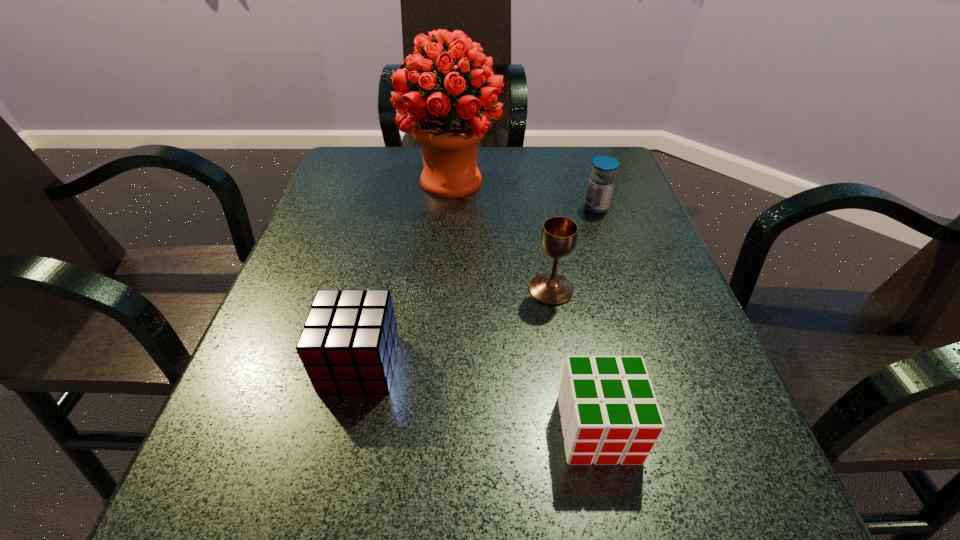
You are a GUI agent. You are given a task and a screenshot of the screen. Output one action in this format:
    pyautogui.click(x=<x>, y=<y>)
    Task: Click on the free space at the right edge of the desktop
    This screenshot has height=540, width=960.
    Given the screenshot: What is the action you would take?
    pyautogui.click(x=708, y=436)

Where is `vacant region at the far left corner of the desktop`? The image size is (960, 540). vacant region at the far left corner of the desktop is located at coordinates (340, 180).

The width and height of the screenshot is (960, 540). What are the coordinates of `vacant space at the near left corner of the desktop` in the screenshot? It's located at (278, 474).

At what (x,y) coordinates should I click in order to perform the action: click on vacant position at the far right corner of the desktop. Please return your answer as a coordinate pair (x, y). Image resolution: width=960 pixels, height=540 pixels. Looking at the image, I should click on (596, 156).

You are a GUI agent. You are given a task and a screenshot of the screen. Output one action in this format:
    pyautogui.click(x=<x>, y=<y>)
    Task: Click on the blank space at the near right corner of the desktop
    
    Given the screenshot: What is the action you would take?
    pyautogui.click(x=695, y=529)

Identify the location of vacant space that is in between the left cube and the third nearest object. The width and height of the screenshot is (960, 540). (455, 327).

Locate an element on the screen. The width and height of the screenshot is (960, 540). unoccupied position between the chalice and the fourth farthest object is located at coordinates [455, 327].

Identify the location of free point between the rightmost object and the tallest object. The width and height of the screenshot is (960, 540). (524, 194).

Where is `vacant space in between the farther cube and the nearer cube`? This screenshot has height=540, width=960. vacant space in between the farther cube and the nearer cube is located at coordinates (479, 396).

Locate an element on the screen. This screenshot has width=960, height=540. free point between the nearer cube and the bouquet is located at coordinates (525, 305).